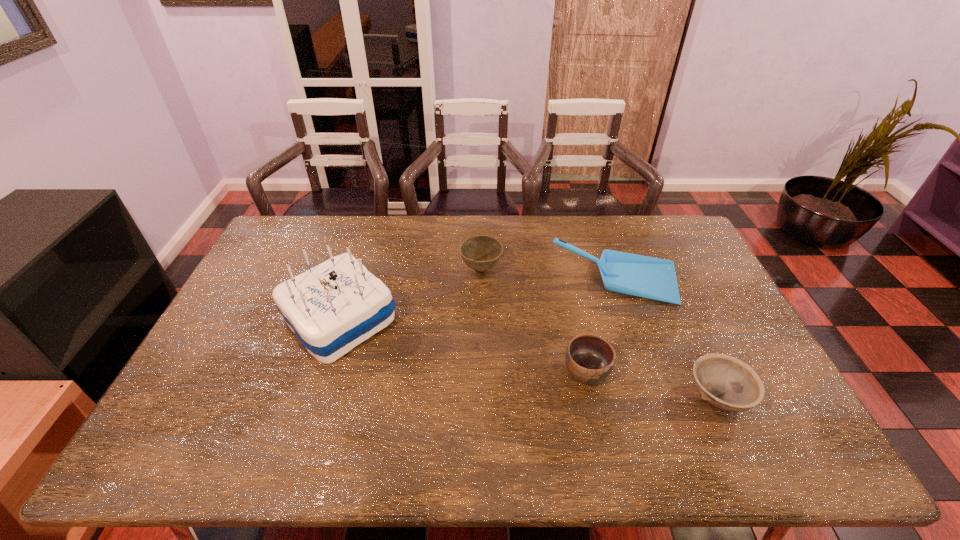
Locate an element on the screen. This screenshot has width=960, height=540. the leftmost object is located at coordinates (333, 307).

Image resolution: width=960 pixels, height=540 pixels. In order to click on the tallest object in this screenshot , I will do `click(333, 307)`.

This screenshot has width=960, height=540. Identify the location of dustpan. (648, 277).

Find the location of `the farthest bowl`. the farthest bowl is located at coordinates (481, 253).

What are the coordinates of `the leftmost bowl` in the screenshot? It's located at 481,253.

At what (x,y) coordinates should I click in order to perform the action: click on the second bowl from left to right. Please return your answer as a coordinate pair (x, y). Looking at the image, I should click on (589, 358).

Find the location of a particular element. This screenshot has width=960, height=540. the rightmost bowl is located at coordinates (725, 382).

Image resolution: width=960 pixels, height=540 pixels. What are the coordinates of `vacant space located on the back of the leftmost object` in the screenshot? It's located at (360, 253).

The image size is (960, 540). What are the coordinates of `free space located 0.370m on the front of the second tallest object` in the screenshot? It's located at (662, 414).

The width and height of the screenshot is (960, 540). In order to click on vacant space located 0.140m on the back of the farthest bowl in this screenshot , I will do `click(481, 232)`.